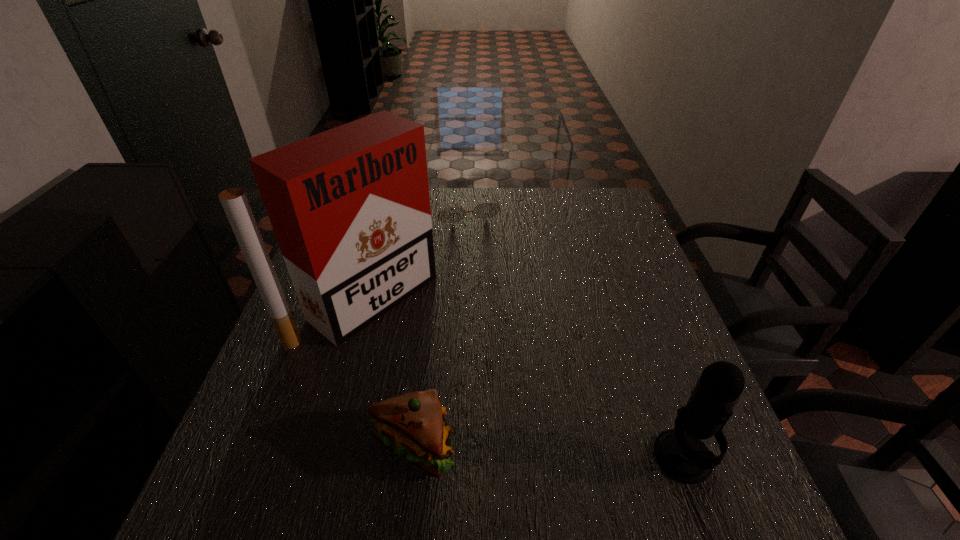
Image resolution: width=960 pixels, height=540 pixels. What are the coordinates of `sandwich` in the screenshot? It's located at (412, 424).

The width and height of the screenshot is (960, 540). I want to click on microphone, so click(680, 453).

The width and height of the screenshot is (960, 540). Identify the location of the rightmost object. (680, 453).

Where is `cigarette case`? cigarette case is located at coordinates (350, 208).

Locate an element on the screen. This screenshot has height=540, width=960. the tallest object is located at coordinates (350, 208).

Identify the location of the farthest object. (485, 210).

Identify the location of sunglasses. The image size is (960, 540). (485, 210).

Locate an element on the screen. This screenshot has height=540, width=960. free region located 0.290m on the back of the second shortest object is located at coordinates (430, 308).

In order to click on vacant region located on the back of the microphone in this screenshot , I will do tap(652, 370).

Image resolution: width=960 pixels, height=540 pixels. I want to click on free space located on the front-facing side of the tallest object, so click(431, 343).